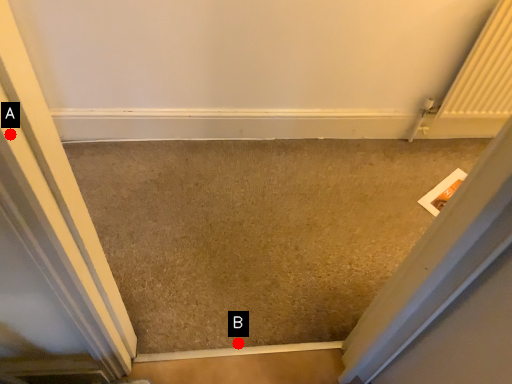
Question: Two points are circled on the image, labeled by A and B beside each circle. Which point is farther from the camera taking this photo?

Choices:
 (A) A is further
 (B) B is further

Answer: (B)